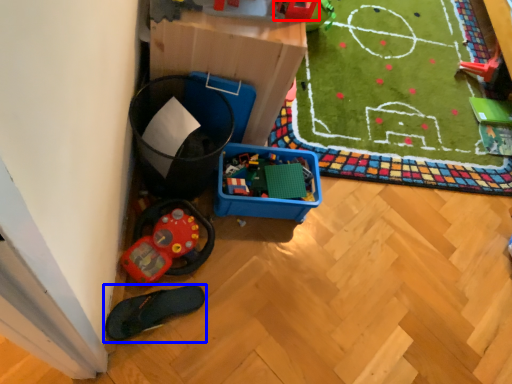
Question: Which object is closer to the camera taking this photo, toy (highlighted by a red box) or footwear (highlighted by a blue box)?

Choices:
 (A) toy
 (B) footwear

Answer: (A)